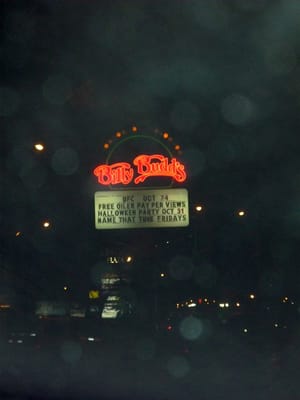
The height and width of the screenshot is (400, 300). Find the location of `corner`. corner is located at coordinates (287, 394), (9, 393), (10, 21), (293, 6).